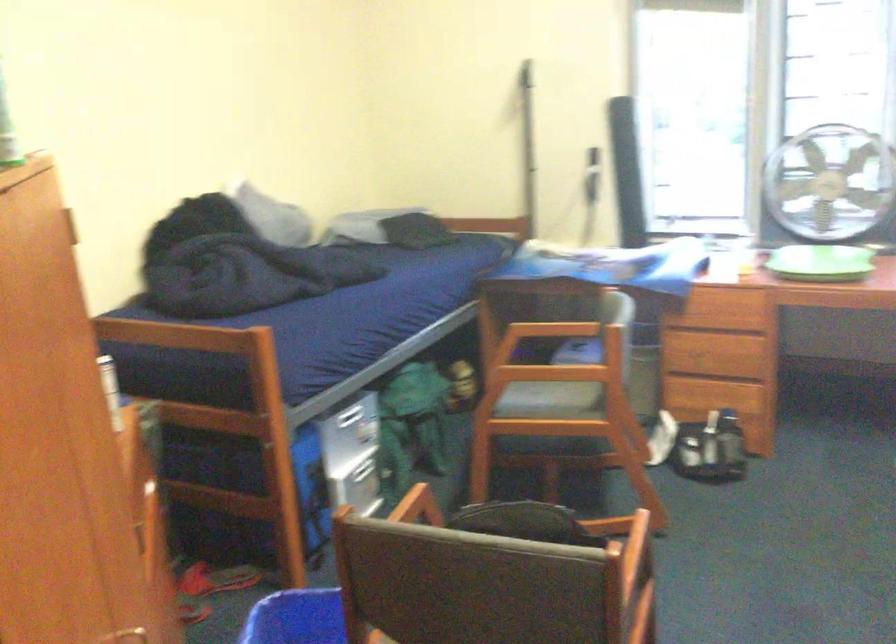
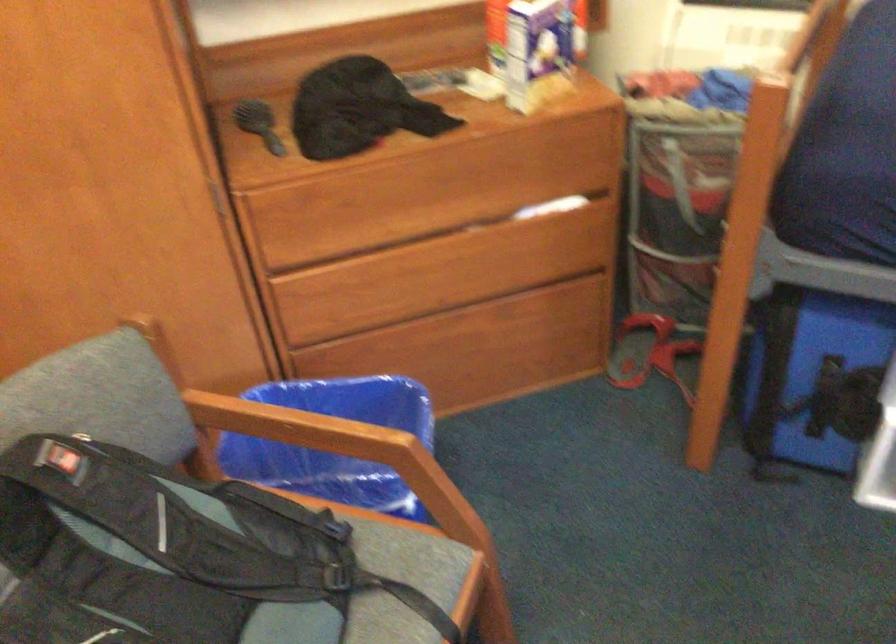
Question: I am providing you with two images of the same scene from different viewpoints. Which of the following objects are not visible in image2?

Choices:
 (A) black ink stamp
 (B) blue plastic bin
 (C) wooden chair armrest
 (D) wooden drawer edge

Answer: (B)